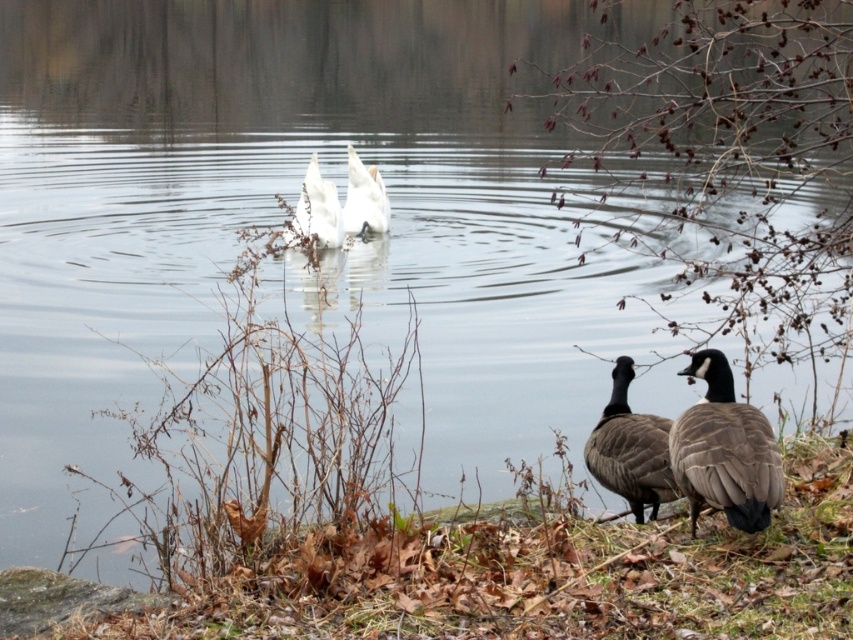
Does brown feathered duck at lower right have a larger size compared to white matte goose at center?

No, brown feathered duck at lower right is not bigger than white matte goose at center.

This screenshot has width=853, height=640. Describe the element at coordinates (630, 449) in the screenshot. I see `brown feathered duck at lower right` at that location.

This screenshot has width=853, height=640. I want to click on brown feathered duck at lower right, so click(x=630, y=449).

Who is more forward, (704, 404) or (369, 230)?

Positioned in front is point (704, 404).

From the picture: Does gray feathered duck at lower right have a greater height compared to white matte goose at center?

Incorrect, gray feathered duck at lower right's height is not larger of white matte goose at center's.

Locate an element on the screen. This screenshot has height=640, width=853. gray feathered duck at lower right is located at coordinates (724, 451).

What do you see at coordinates (630, 449) in the screenshot? This screenshot has width=853, height=640. I see `brown feathered duck at lower right` at bounding box center [630, 449].

Locate an element on the screen. This screenshot has height=640, width=853. brown feathered duck at lower right is located at coordinates (630, 449).

Describe the element at coordinates (630, 449) in the screenshot. I see `brown feathered duck at lower right` at that location.

Identify the location of brown feathered duck at lower right. 630,449.